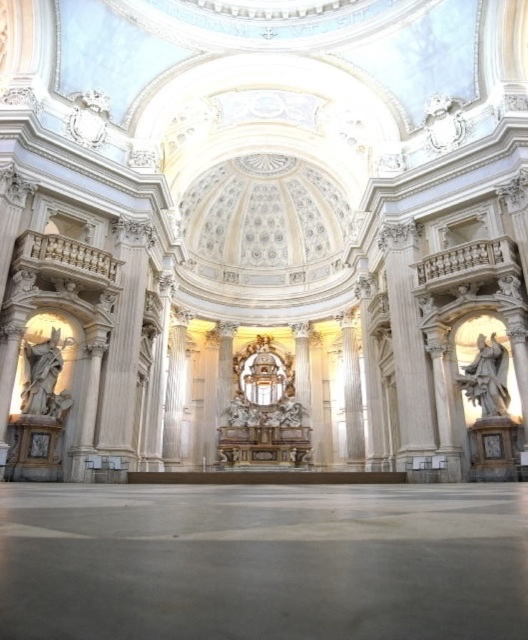
You are standing in the church and want to take a photo of both the white marble statue at left and the white marble statue at right. Which statue should you position closer to the camera to include both in the frame?

The white marble statue at left is positioned on the left side of white marble statue at right, so to include both in the frame, position the camera closer to the white marble statue at right.